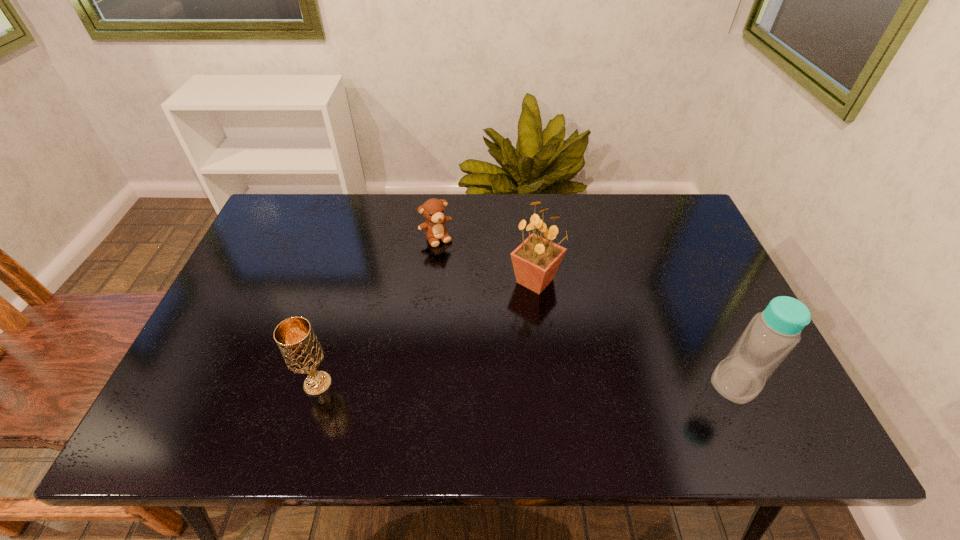
Find the location of a particular element. The width and height of the screenshot is (960, 540). free space at the far edge is located at coordinates (588, 218).

The width and height of the screenshot is (960, 540). What are the coordinates of `vacant area at the near edge` in the screenshot? It's located at (627, 379).

Identify the location of free space at the left edge. (249, 254).

The image size is (960, 540). In order to click on free space at the right edge of the desktop in this screenshot , I will do `click(686, 258)`.

The image size is (960, 540). In the image, there is a desktop. Find the location of `vacant space at the far left corner`. vacant space at the far left corner is located at coordinates (307, 240).

Identify the location of vacant space at the far right corner of the desktop. The image size is (960, 540). (652, 233).

This screenshot has height=540, width=960. What are the coordinates of `vacant point located between the rightmost object and the chalice` in the screenshot? It's located at (526, 383).

Image resolution: width=960 pixels, height=540 pixels. I want to click on free point between the bottle and the shortest object, so click(586, 310).

Locate an element on the screen. unoccupied position between the third nearest object and the bottle is located at coordinates (636, 332).

Find the location of a particular element. This screenshot has height=540, width=960. unoccupied position between the farthest object and the second shortest object is located at coordinates (376, 311).